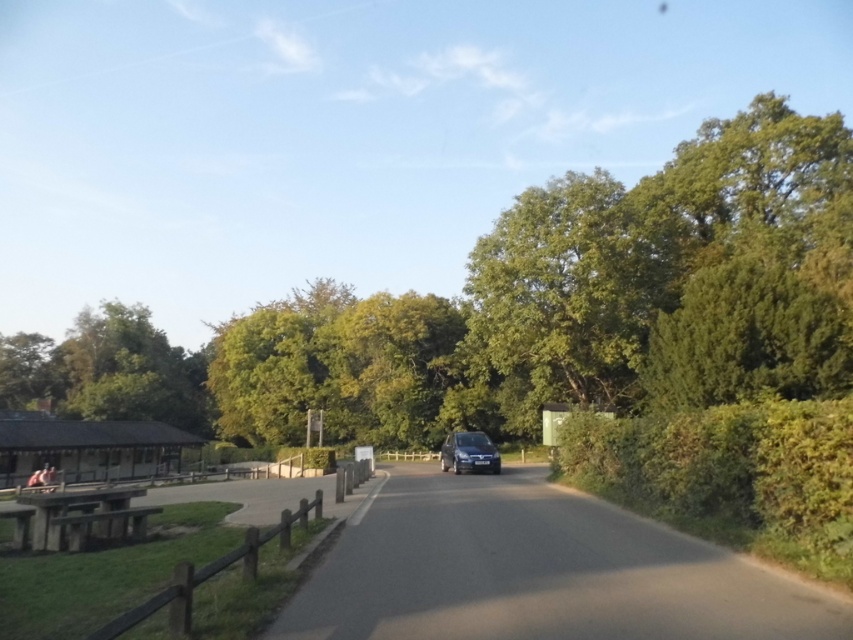
You are driving a delivery van that is 2.5 meters wide and need to pass by the satin black car at center parked on the black asphalt driveway at center. Can your van fit through the space between the car and the road edge?

The black asphalt driveway at center is positioned on the right side of the satin black car at center, but the exact width of the available space isn generated in the Objects Description. Without knowing the specific dimensions, it is impossible to determine if the van can safely pass.

In the scene shown: You are a delivery driver who needs to park your truck, which is 6 meters long, on the black asphalt driveway at center. The satin black car at center is currently parked there. Can the driveway accommodate both your truck and the car if you move the car?

The black asphalt driveway at center is smaller than the satin black car at center. Since the driveway is smaller than the car already parked there, it cannot accommodate both the truck and the car even if the car is moved.